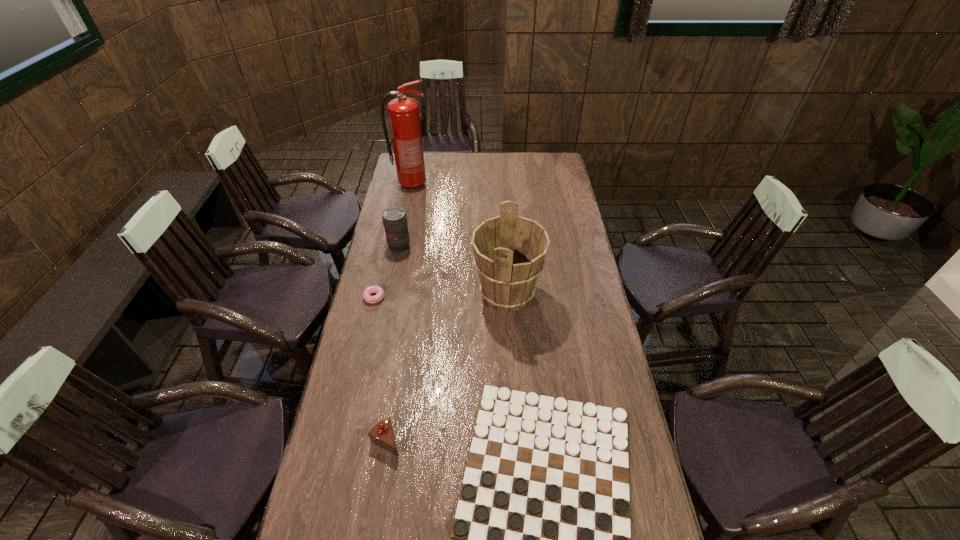
Find the location of a particular element. the farthest object is located at coordinates (404, 117).

At what (x,y) coordinates should I click in order to perform the action: click on the tallest object. Please return your answer as a coordinate pair (x, y). This screenshot has height=540, width=960. Looking at the image, I should click on (404, 117).

Find the location of a particular element. The width and height of the screenshot is (960, 540). bucket is located at coordinates (509, 251).

The height and width of the screenshot is (540, 960). In order to click on the fourth shortest object in this screenshot , I will do `click(394, 218)`.

You are a GUI agent. You are given a task and a screenshot of the screen. Output one action in this format:
    pyautogui.click(x=<x>, y=<y>)
    Task: Click on the second farthest object
    This screenshot has width=960, height=540.
    Given the screenshot: What is the action you would take?
    pyautogui.click(x=394, y=218)

Where is `the third shortest object`? The width and height of the screenshot is (960, 540). the third shortest object is located at coordinates (382, 434).

Where is `doughnut`? This screenshot has height=540, width=960. doughnut is located at coordinates (367, 297).

Where is `free location located 0.320m on the handle side the tallest object`? free location located 0.320m on the handle side the tallest object is located at coordinates (493, 184).

Where is `free point located 0.070m on the front of the bucket`? Image resolution: width=960 pixels, height=540 pixels. free point located 0.070m on the front of the bucket is located at coordinates (510, 338).

This screenshot has height=540, width=960. I want to click on free space located 0.060m on the side of the second farthest object where the control switches are located, so click(396, 264).